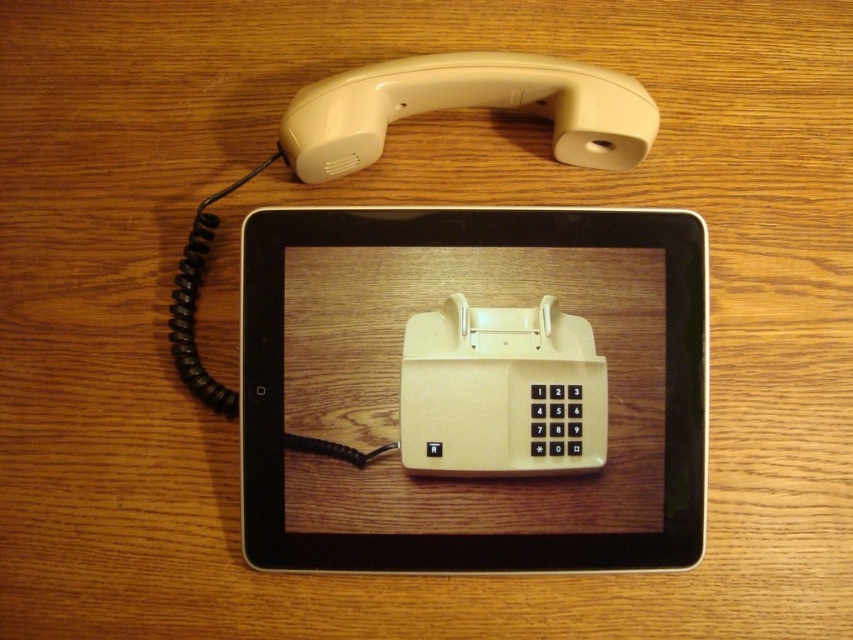
Can you confirm if beige plastic tablet at center is positioned above beige plastic phone at center?

Actually, beige plastic tablet at center is below beige plastic phone at center.

Who is lower down, beige plastic tablet at center or beige plastic phone at center?

Positioned lower is beige plastic tablet at center.

Who is more distant from viewer, (703, 410) or (556, 326)?

The point (556, 326) is more distant.

This screenshot has width=853, height=640. Identify the location of beige plastic tablet at center. (474, 388).